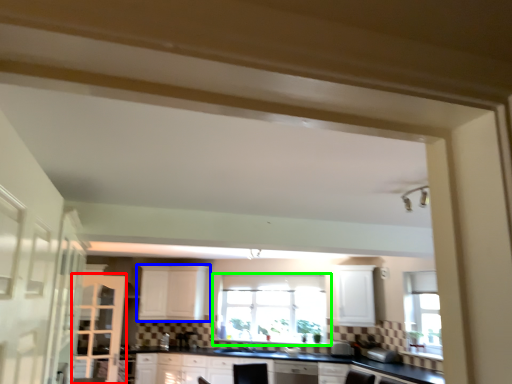
Question: Which is farther away from screen door (highlighted by a red box)? cabinetry (highlighted by a blue box) or window (highlighted by a green box)?

Choices:
 (A) cabinetry
 (B) window

Answer: (B)